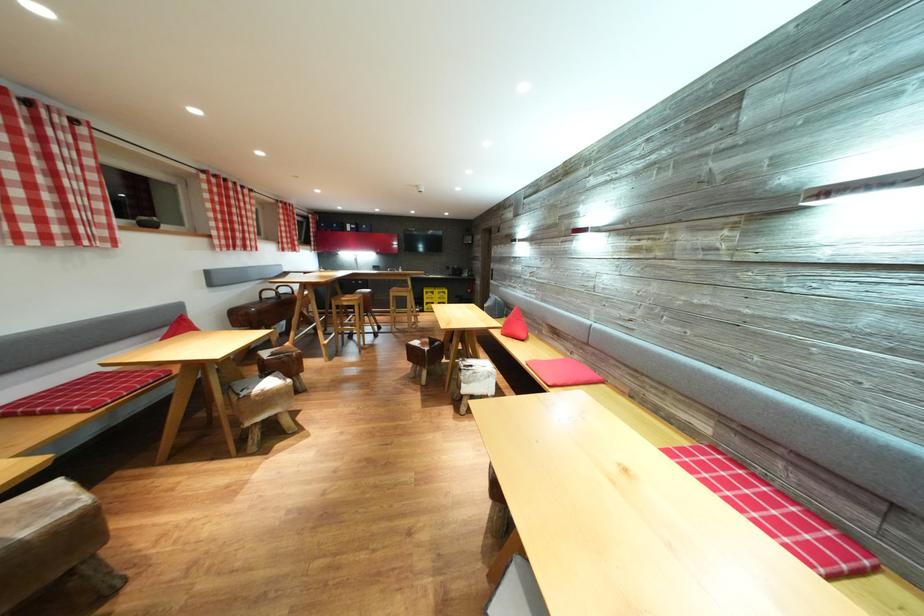
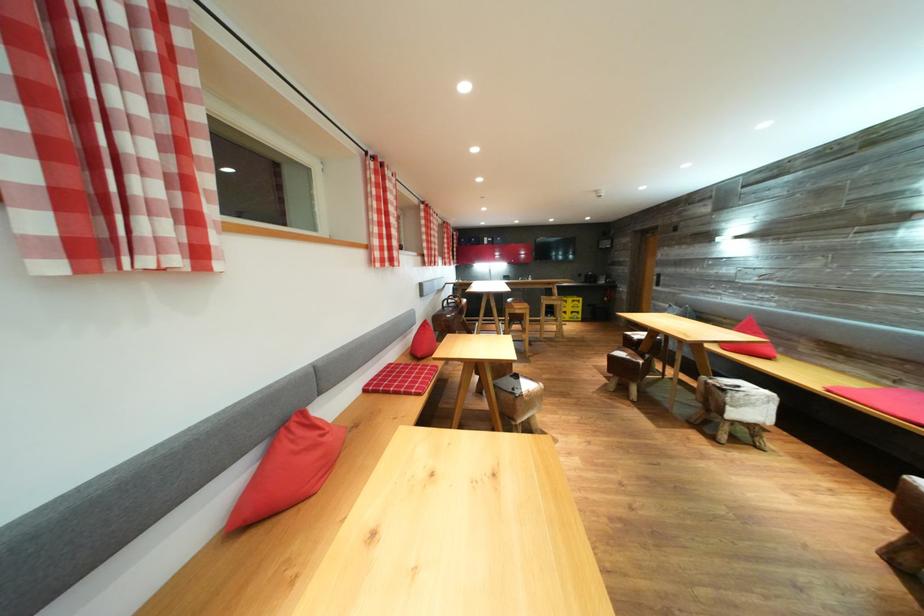
Question: The images are taken continuously from a first-person perspective. In which direction are you moving?

Choices:
 (A) Left
 (B) Right
 (C) Forward
 (D) Backward

Answer: (A)